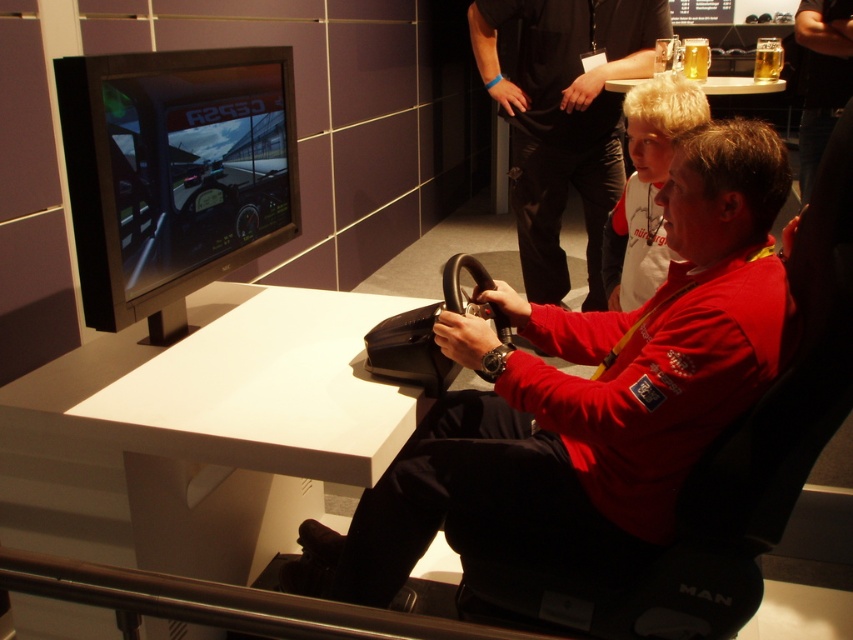
Question: Which point appears closest to the camera in this image?

Choices:
 (A) (592, 266)
 (B) (630, 134)

Answer: (B)

Question: Can you confirm if matte black steering wheel at center is positioned to the right of white cotton shirt at upper center?

Choices:
 (A) yes
 (B) no

Answer: (B)

Question: Which object is closer to the camera taking this photo?

Choices:
 (A) matte red shirt at center
 (B) white cotton shirt at upper center

Answer: (B)

Question: Does matte black steering wheel at center appear on the right side of white cotton shirt at upper center?

Choices:
 (A) yes
 (B) no

Answer: (B)

Question: Observing the image, what is the correct spatial positioning of matte black steering wheel at center in reference to matte red shirt at center?

Choices:
 (A) left
 (B) right

Answer: (A)

Question: Which of these objects is positioned farthest from the matte black steering wheel at center?

Choices:
 (A) white cotton shirt at upper center
 (B) matte red shirt at center

Answer: (B)